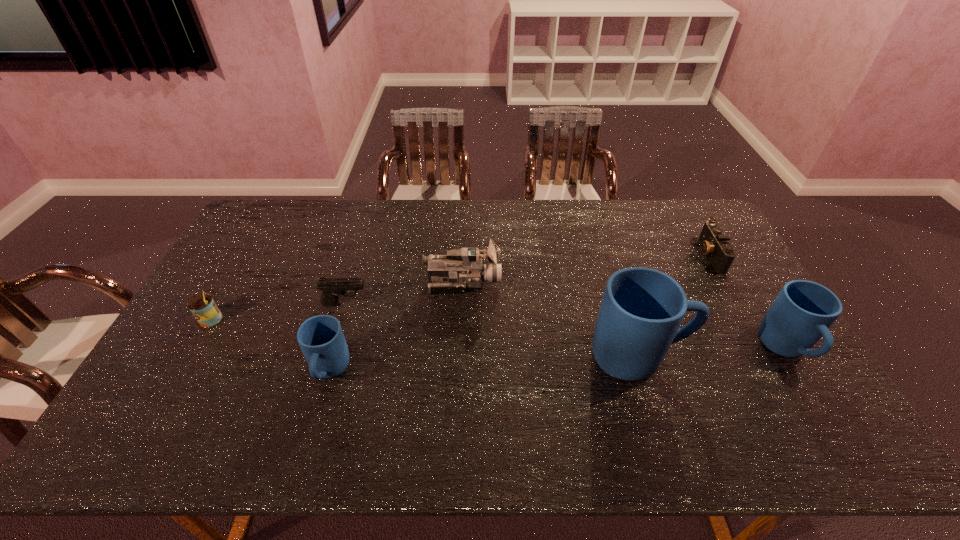
The image size is (960, 540). Find the location of `object located in the far right corner section of the desktop`. object located in the far right corner section of the desktop is located at coordinates (714, 244).

I want to click on vacant region at the far edge of the desktop, so click(x=533, y=215).

Where is `vacant area at the near edge of the desktop`? This screenshot has height=540, width=960. vacant area at the near edge of the desktop is located at coordinates (248, 390).

This screenshot has width=960, height=540. I want to click on vacant space at the left edge of the desktop, so click(233, 267).

Where is `free space at the right edge of the desktop`? The height and width of the screenshot is (540, 960). free space at the right edge of the desktop is located at coordinates (727, 295).

The image size is (960, 540). In the image, there is a desktop. Find the location of `free space at the near right corner`. free space at the near right corner is located at coordinates (795, 409).

The image size is (960, 540). Find the location of `free space that is in between the can and the leftmost mug`. free space that is in between the can and the leftmost mug is located at coordinates (270, 346).

Locate an element on the screen. free space between the shortest object and the fifth nearest object is located at coordinates (526, 280).

You are a GUI agent. You are given a task and a screenshot of the screen. Output one action in this format:
    pyautogui.click(x=<x>, y=<y>)
    Task: Click on the free spot between the shortest mug and the rightmost mug
    The width and height of the screenshot is (960, 540).
    Given the screenshot: What is the action you would take?
    pyautogui.click(x=558, y=360)

Where is `free area in between the rightmost mug and the shortest mug`? free area in between the rightmost mug and the shortest mug is located at coordinates (558, 360).